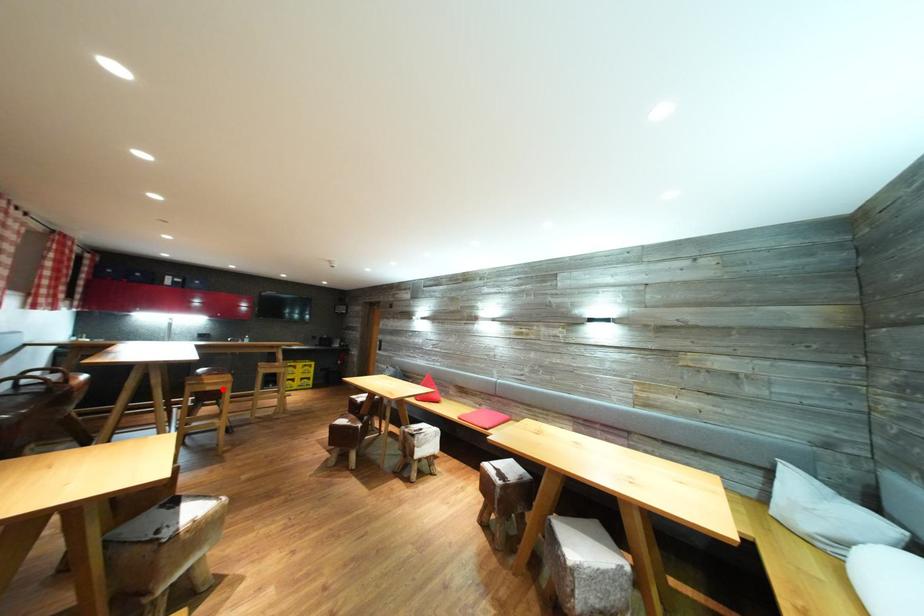
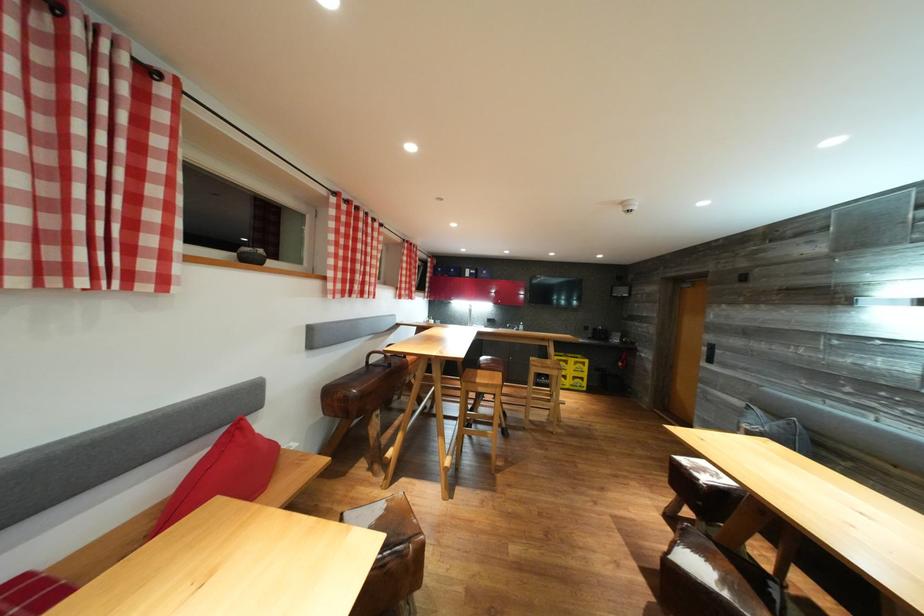
Question: I am providing you with two images of the same scene from different viewpoints. A red point is marked on the first image. Is the red point's position out of view in image 2?

Choices:
 (A) Yes
 (B) No

Answer: (B)